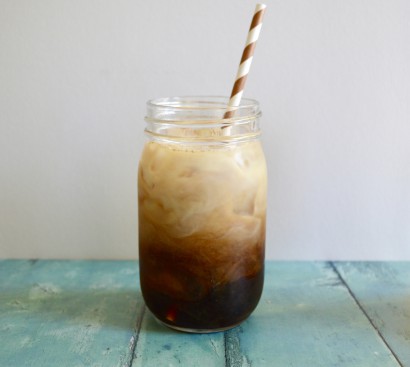
Identify the location of light grey wall. (330, 190).